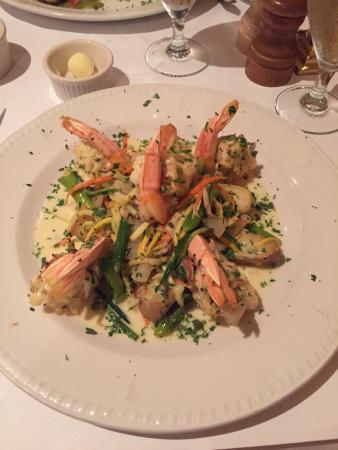
This screenshot has height=450, width=338. Find the location of `plate`. plate is located at coordinates (128, 11), (165, 393).